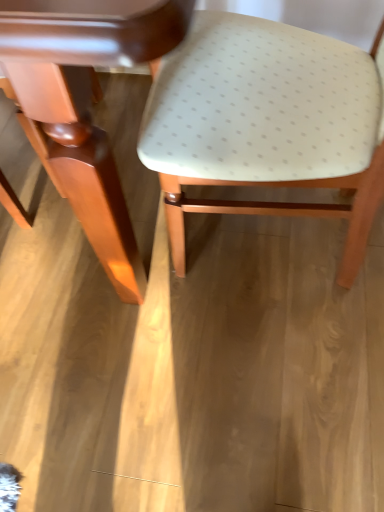
Locate an element on the screen. matte white table at center is located at coordinates (83, 104).

The height and width of the screenshot is (512, 384). What do you see at coordinates (83, 104) in the screenshot?
I see `matte white table at center` at bounding box center [83, 104].

Describe the element at coordinates (267, 123) in the screenshot. I see `matte white plastic chair at center` at that location.

You are a GUI agent. You are given a task and a screenshot of the screen. Output one action in this format:
    pyautogui.click(x=<x>, y=<y>)
    Task: Click on the matte white plastic chair at center
    The width and height of the screenshot is (384, 512).
    Given the screenshot: What is the action you would take?
    pyautogui.click(x=267, y=123)

What is the approximate height of matte white plastic chair at center?

matte white plastic chair at center is 29.11 inches in height.

Where is `matte white table at center`? This screenshot has height=512, width=384. matte white table at center is located at coordinates (83, 104).

Considering the positions of objects matte white plastic chair at center and matte white table at center in the image provided, who is more to the left, matte white plastic chair at center or matte white table at center?

matte white table at center.

Considering the relative positions of matte white plastic chair at center and matte white table at center in the image provided, is matte white plastic chair at center behind matte white table at center?

Yes, it is behind matte white table at center.

Considering the positions of point (371, 115) and point (95, 10), is point (371, 115) closer or farther from the camera than point (95, 10)?

Point (371, 115).

From the image's perspective, is matte white plastic chair at center located beneath matte white table at center?

Yes, from the image's perspective, matte white plastic chair at center is beneath matte white table at center.

From a real-world perspective, is matte white plastic chair at center beneath matte white table at center?

Yes, from a real-world perspective, matte white plastic chair at center is below matte white table at center.

Can you confirm if matte white plastic chair at center is thinner than matte white table at center?

Yes.

Considering the sizes of objects matte white plastic chair at center and matte white table at center in the image provided, who is shorter, matte white plastic chair at center or matte white table at center?

Standing shorter between the two is matte white plastic chair at center.

Is matte white plastic chair at center bigger or smaller than matte white table at center?

matte white plastic chair at center is smaller than matte white table at center.

Is matte white plastic chair at center completely or partially outside of matte white table at center?

That's correct, matte white plastic chair at center is outside of matte white table at center.

Are matte white plastic chair at center and matte white table at center far apart?

No, matte white plastic chair at center is not far from matte white table at center.

Is matte white plastic chair at center looking in the opposite direction of matte white table at center?

No.

How different are the orientations of matte white plastic chair at center and matte white table at center in degrees?

matte white plastic chair at center and matte white table at center are facing 91.2 degrees away from each other.

I want to click on chair located underneath the matte white table at center (from a real-world perspective), so click(x=267, y=123).

Considering the positions of objects matte white table at center and matte white plastic chair at center in the image provided, who is more to the right, matte white table at center or matte white plastic chair at center?

From the viewer's perspective, matte white plastic chair at center appears more on the right side.

Consider the image. Is matte white table at center further to camera compared to matte white plastic chair at center?

No.

Which is farther, (129, 49) or (309, 115)?

Positioned behind is point (309, 115).

From the image's perspective, between matte white table at center and matte white plastic chair at center, which one is located above?

matte white table at center is shown above in the image.

From a real-world perspective, who is located higher, matte white table at center or matte white plastic chair at center?

matte white table at center.

Consider the image. Considering the sizes of objects matte white table at center and matte white plastic chair at center in the image provided, who is thinner, matte white table at center or matte white plastic chair at center?

Thinner between the two is matte white plastic chair at center.

Considering the relative sizes of matte white table at center and matte white plastic chair at center in the image provided, is matte white table at center taller than matte white plastic chair at center?

Yes, matte white table at center is taller than matte white plastic chair at center.

Who is bigger, matte white table at center or matte white plastic chair at center?

Bigger between the two is matte white table at center.

Is matte white table at center located outside matte white plastic chair at center?

Yes, matte white table at center is not within matte white plastic chair at center.

Are matte white table at center and matte white plastic chair at center far apart?

No, matte white table at center is in close proximity to matte white plastic chair at center.

Is matte white table at center facing towards matte white plastic chair at center?

No, matte white table at center is not facing towards matte white plastic chair at center.

Where is `chair that is on the right side of matte white table at center`? The width and height of the screenshot is (384, 512). chair that is on the right side of matte white table at center is located at coordinates (267, 123).

Identify the location of chair that is below the matte white table at center (from the image's perspective). The width and height of the screenshot is (384, 512). (267, 123).

What are the coordinates of `table in front of the matte white plastic chair at center` in the screenshot? It's located at (83, 104).